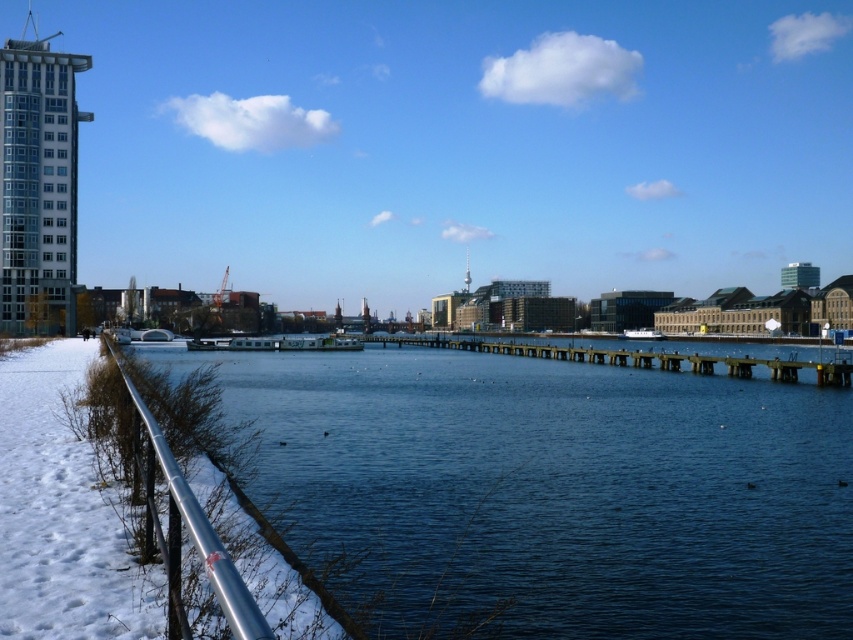
You are standing at the edge of the waterfront and want to take a photo of the glassy reflective skyscraper at upper left and the wooden at center. Which object should you adjust your camera angle upwards to capture in your photo?

You should adjust your camera angle upwards to capture the glassy reflective skyscraper at upper left because it is positioned above the wooden at center.

You are standing at the edge of the waterfront scene and want to locate the glassy reflective skyscraper at upper left. According to the coordinates provided, where exactly would you look to find it?

The glassy reflective skyscraper at upper left is located at coordinates point (38, 184).